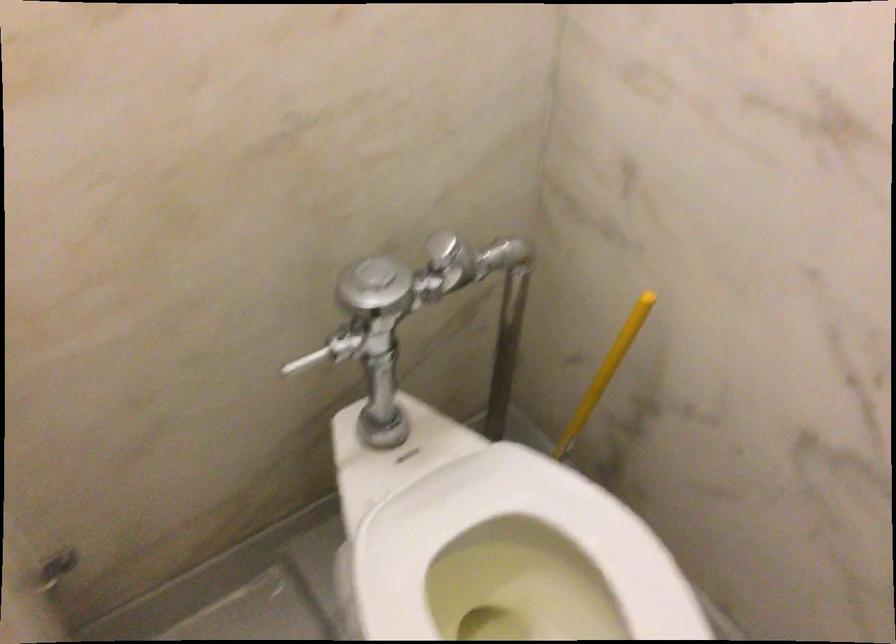
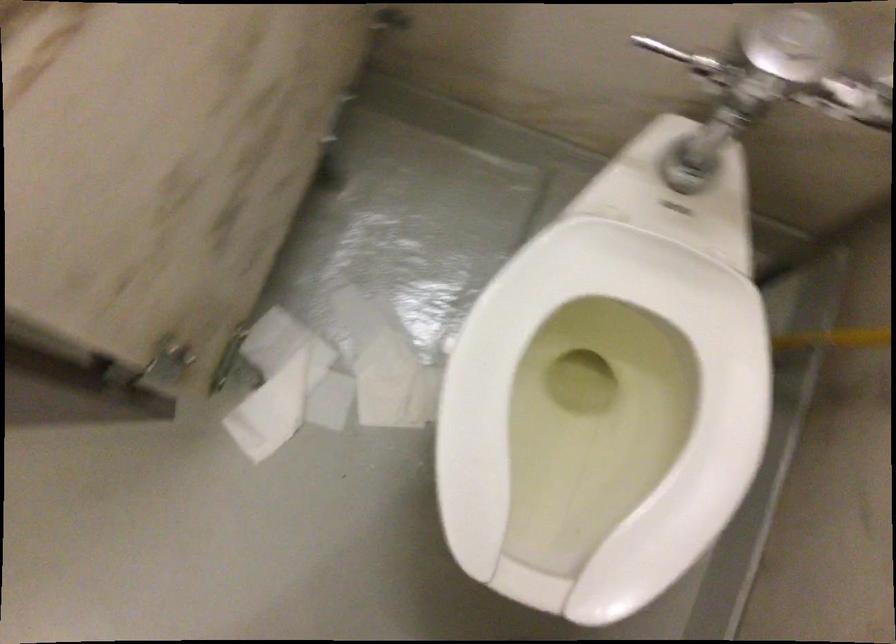
Question: Based on the continuous images, in which direction is the camera rotating? Reply with the corresponding letter.

Choices:
 (A) Left
 (B) Right
 (C) Up
 (D) Down

Answer: (D)